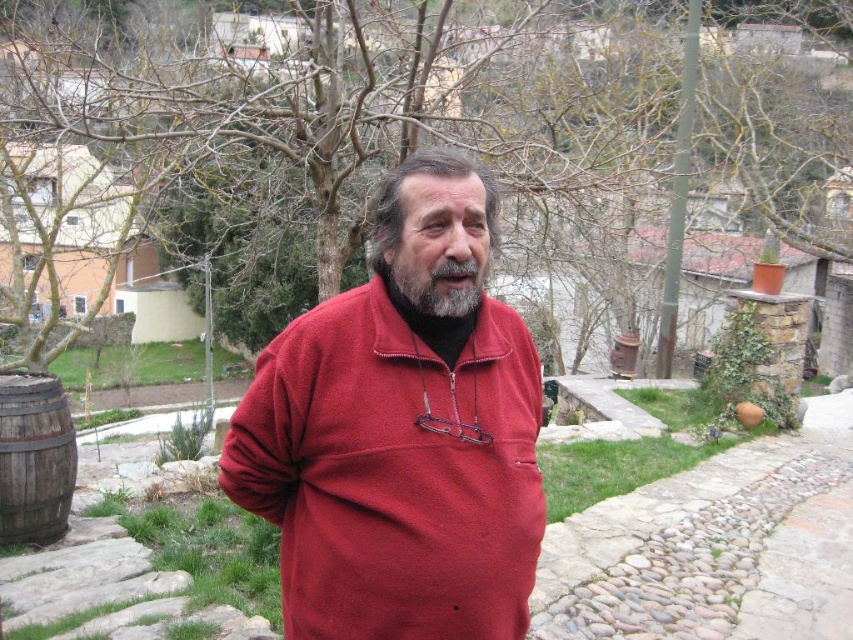
Question: Estimate the real-world distances between objects in this image. Which object is closer to the gray matte hair at center?

Choices:
 (A) graywoollybeard at center
 (B) bare branches at upper center

Answer: (A)

Question: Which object is closer to the camera taking this photo?

Choices:
 (A) bare branches at upper center
 (B) gray matte hair at center
 (C) graywoollybeard at center
 (D) matte fleece pullover at center

Answer: (C)

Question: Does gray matte hair at center lie in front of graywoollybeard at center?

Choices:
 (A) yes
 (B) no

Answer: (B)

Question: Which point is farther to the camera?

Choices:
 (A) (38, 305)
 (B) (473, 268)
 (C) (448, 164)
 (D) (527, 476)

Answer: (A)

Question: Does matte fleece pullover at center have a smaller size compared to gray matte hair at center?

Choices:
 (A) yes
 (B) no

Answer: (B)

Question: Is bare branches at upper center in front of gray matte hair at center?

Choices:
 (A) yes
 (B) no

Answer: (B)